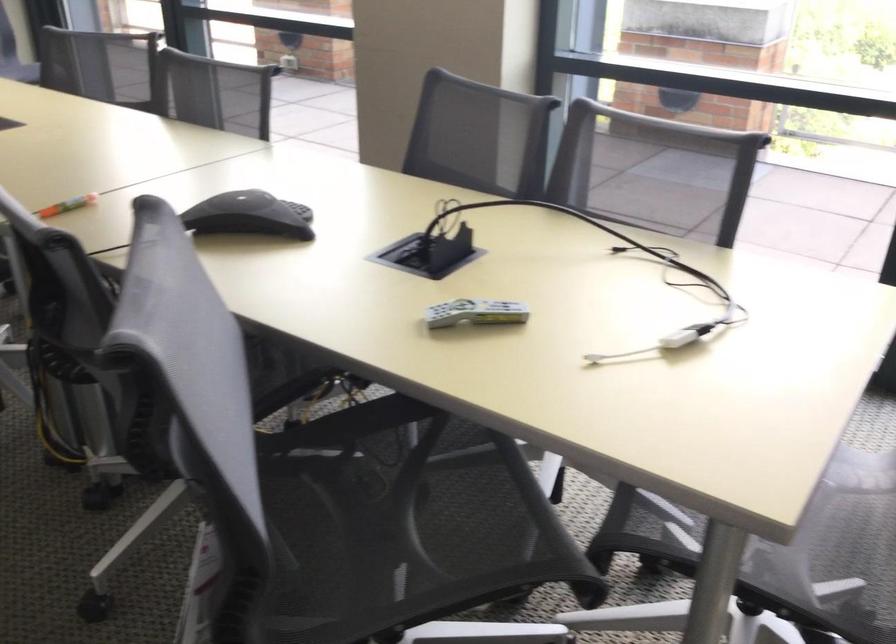
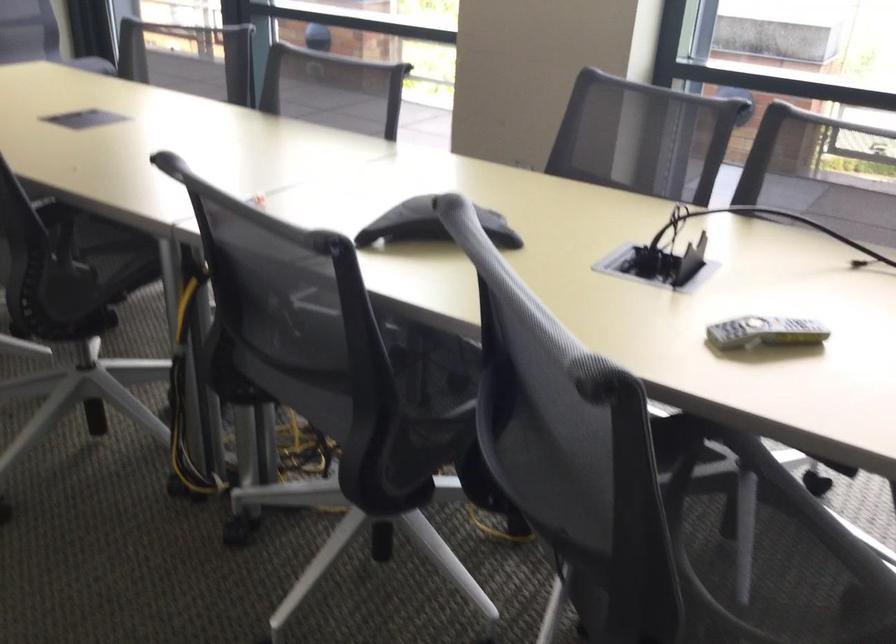
In a continuous first-person perspective shot, in which direction is the camera moving?

The cameraman walked toward left, forward.